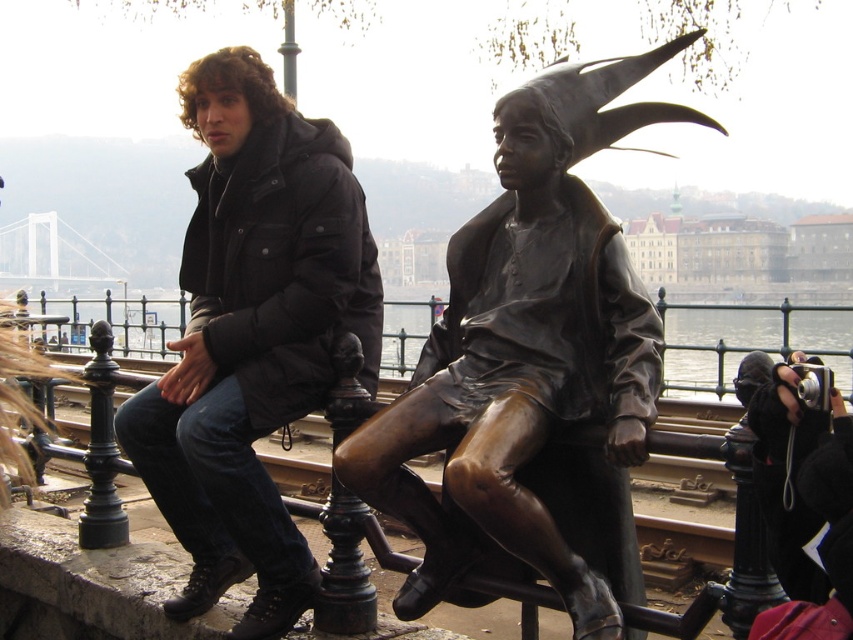
From the picture: You are a photographer trying to capture a shot of the black matte jacket at left and the glossy metallic water at center. The camera you are using has a maximum focus range of 130 feet. Can you capture both objects in focus without moving the camera or the objects?

The black matte jacket at left and glossy metallic water at center are 131.11 feet apart from each other, which exceeds the camera maximum focus range of 130 feet. Therefore, you cannot capture both objects in focus without moving the camera or the objects.

You are a photographer trying to capture both the bronze statue at center and the black matte jacket at left in the same frame. Based on their positions, which object is located to the right of the other?

The bronze statue at center is positioned on the right side of black matte jacket at left, so the bronze statue at center is to the right of the black matte jacket at left.

You are standing in front of the statue and want to take a photo of the black matte jacket at left without the glossy metallic water at center reflecting in the background. Which direction should you move to avoid the reflection?

The black matte jacket at left is to the right of the glossy metallic water at center. To avoid the reflection, move to the left side of the statue so that the glossy metallic water at center is no longer in the background reflection.